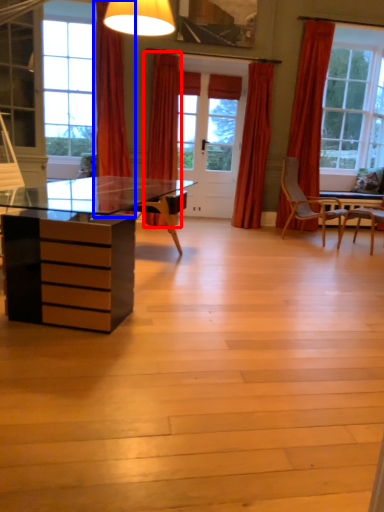
Question: Which point is further to the camera, curtain (highlighted by a red box) or curtain (highlighted by a blue box)?

Choices:
 (A) curtain
 (B) curtain

Answer: (A)